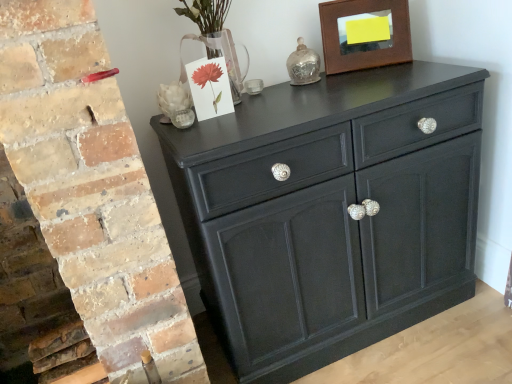
Locate an element on the screen. The width and height of the screenshot is (512, 384). free space in front of white matte sculpture at upper left is located at coordinates (193, 127).